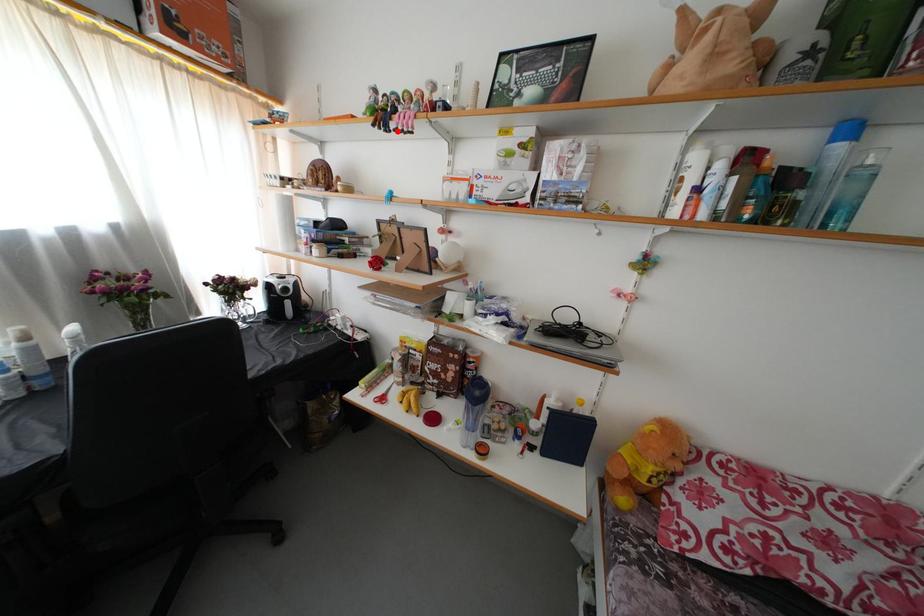
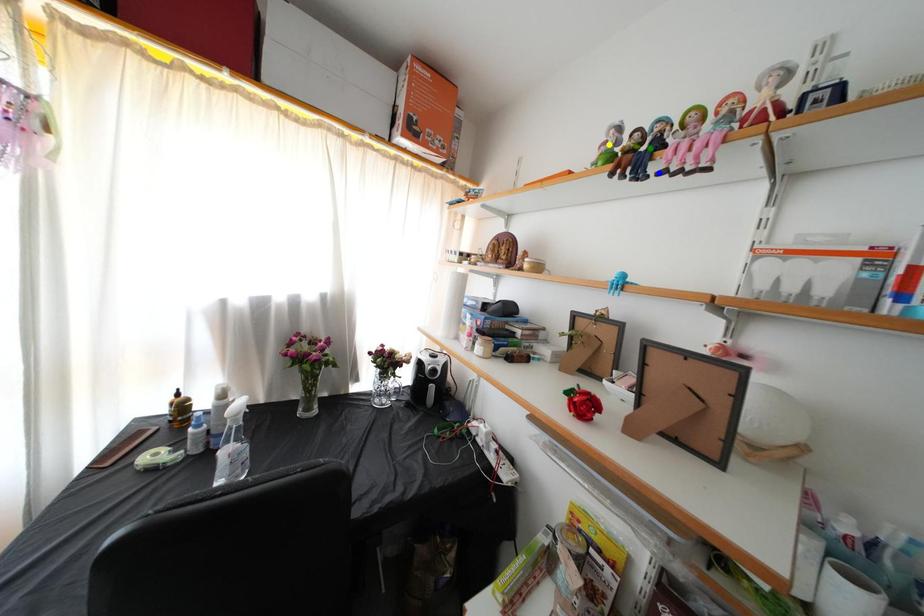
Question: I am providing you with two images of the same scene from different viewpoints. A red point is marked on the first image. You are given multiple points on the second image. Can you choose the point in image 2 that corresponds to the point in image 1?

Choices:
 (A) yellow point
 (B) green point
 (C) blue point

Answer: (C)